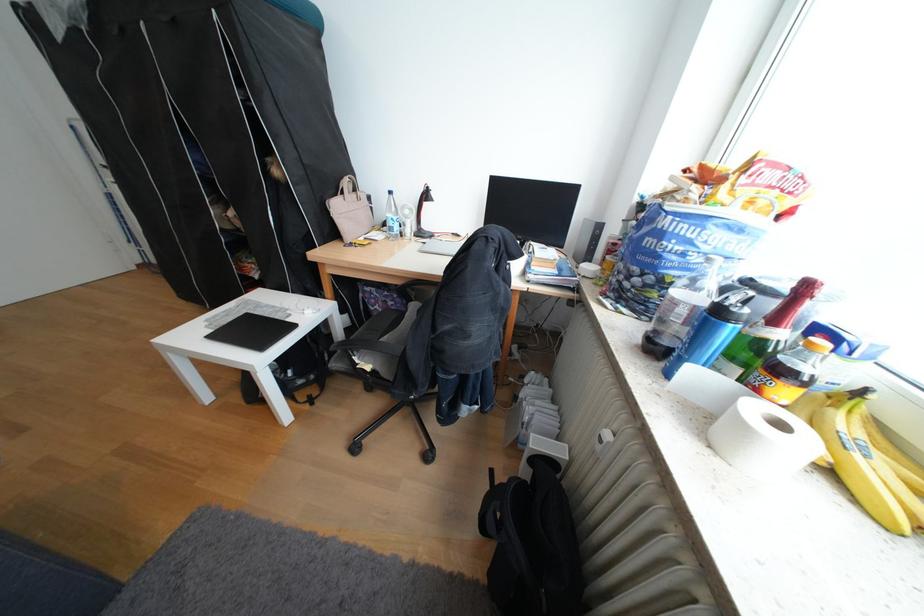
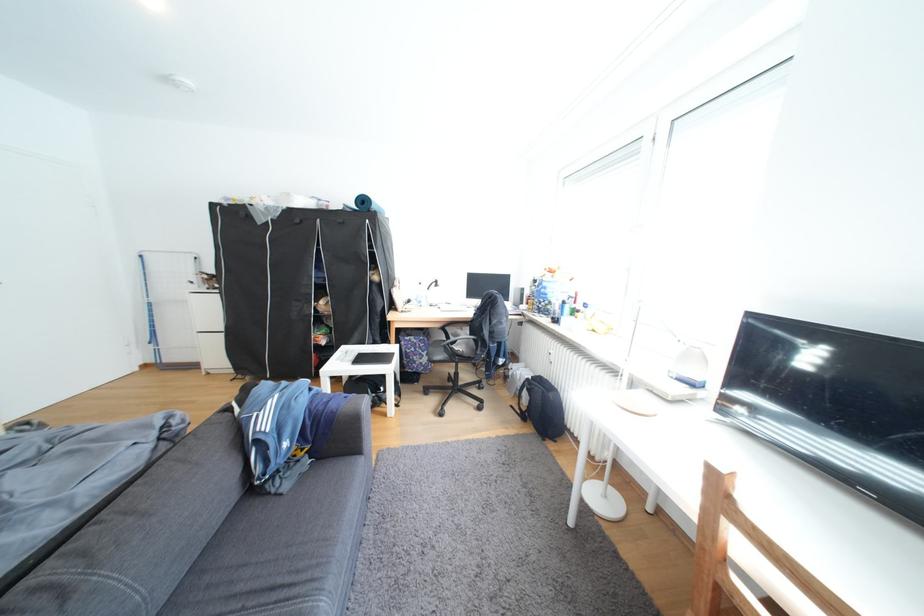
Locate, in the second image, the point that corresponds to (355,193) in the first image.

(408, 286)